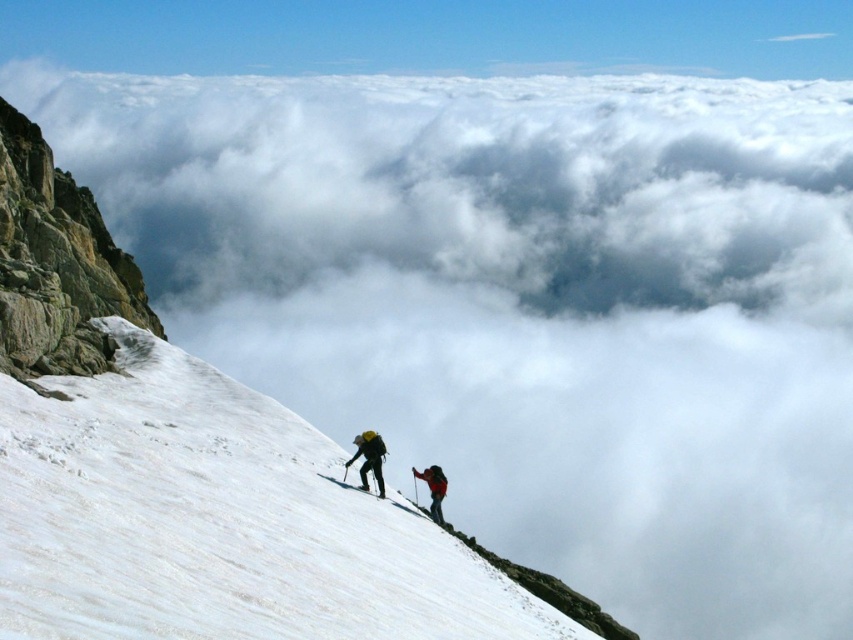
You are planning to carry both the red fabric backpack at center and the black matte ski at lower center during your hike. Which item will take up more space in your storage compartment?

The red fabric backpack at center is larger in size than the black matte ski at lower center, so it will take up more space in the storage compartment.

You are a mountaineer preparing to secure your gear on a steep slope. You have a red fabric backpack at center and a white matte ski at lower center. Which item has a greater width?

The red fabric backpack at center has a greater width than the white matte ski at lower center.